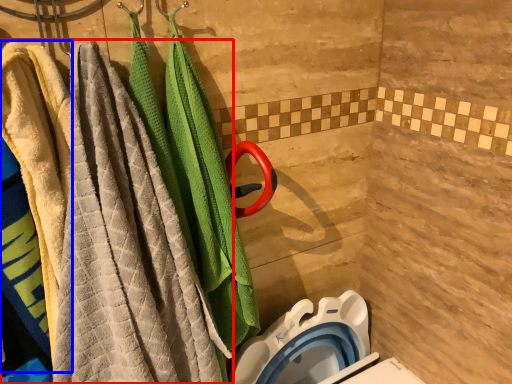
Question: Which of the following is the closest to the observer, towel (highlighted by a red box) or beach towel (highlighted by a blue box)?

Choices:
 (A) towel
 (B) beach towel

Answer: (A)